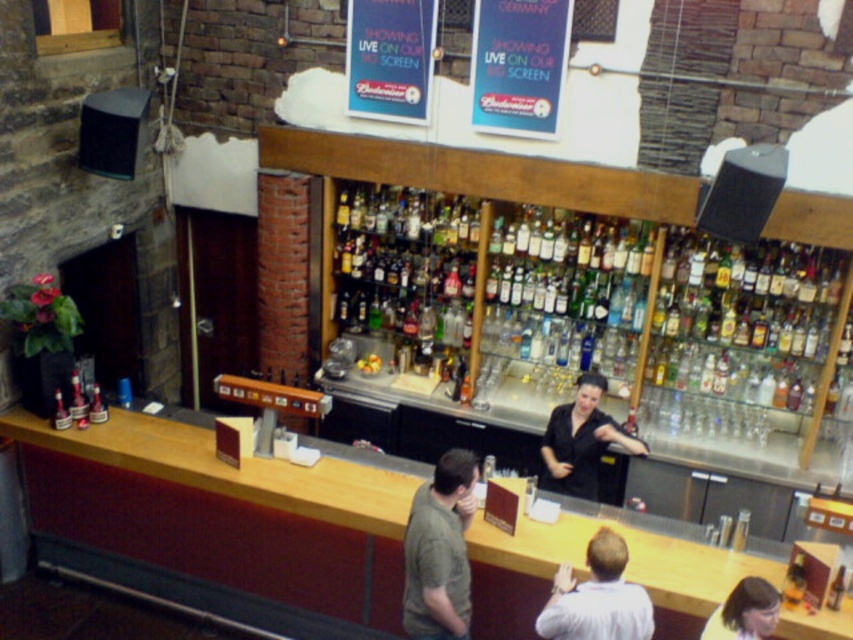
You are a GUI agent. You are given a task and a screenshot of the screen. Output one action in this format:
    pyautogui.click(x=<x>, y=<y>)
    Task: Click on the matte green shirt at center
    The height and width of the screenshot is (640, 853).
    Given the screenshot: What is the action you would take?
    pyautogui.click(x=439, y=552)

Image resolution: width=853 pixels, height=640 pixels. I want to click on matte green shirt at center, so 439,552.

Does matte green shirt at center appear on the left side of blonde hair at lower right?

Indeed, matte green shirt at center is positioned on the left side of blonde hair at lower right.

Image resolution: width=853 pixels, height=640 pixels. What do you see at coordinates (439, 552) in the screenshot? I see `matte green shirt at center` at bounding box center [439, 552].

Between point (412, 518) and point (741, 604), which one is positioned behind?

The point (412, 518) is behind.

You are a GUI agent. You are given a task and a screenshot of the screen. Output one action in this format:
    pyautogui.click(x=<x>, y=<y>)
    Task: Click on the matte green shirt at center
    
    Given the screenshot: What is the action you would take?
    pyautogui.click(x=439, y=552)

In the scene shown: Can you confirm if matte green shirt at center is taller than black matte shirt at center?

Correct, matte green shirt at center is much taller as black matte shirt at center.

Does matte green shirt at center lie in front of black matte shirt at center?

That is True.

Between point (437, 497) and point (595, 403), which one is positioned in front?

Point (437, 497) is in front.

Locate an element on the screen. This screenshot has width=853, height=640. matte green shirt at center is located at coordinates (439, 552).